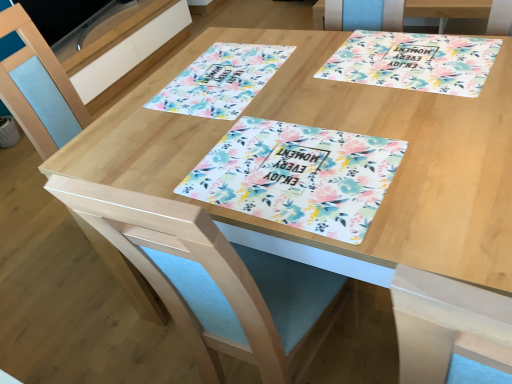
Question: Is blue fabric swivel chair at center not close to floral paper placemat at upper center, positioned as the first flyer in back-to-front order?

Choices:
 (A) yes
 (B) no

Answer: (B)

Question: Is blue fabric swivel chair at center facing towards floral paper placemat at upper center, positioned as the first flyer in back-to-front order?

Choices:
 (A) yes
 (B) no

Answer: (B)

Question: From a real-world perspective, does blue fabric swivel chair at center stand above floral paper placemat at upper center, acting as the second flyer starting from the front?

Choices:
 (A) no
 (B) yes

Answer: (A)

Question: Can you confirm if blue fabric swivel chair at center is taller than floral paper placemat at upper center, acting as the second flyer starting from the front?

Choices:
 (A) yes
 (B) no

Answer: (A)

Question: Can you confirm if blue fabric swivel chair at center is shorter than floral paper placemat at upper center, which is the 2th flyer in bottom-to-top order?

Choices:
 (A) yes
 (B) no

Answer: (B)

Question: Considering the relative positions of floral paper placemat at upper center, marked as the 1th flyer in a top-to-bottom arrangement, and light blue fabric chair at lower left in the image provided, is floral paper placemat at upper center, marked as the 1th flyer in a top-to-bottom arrangement, to the left or to the right of light blue fabric chair at lower left?

Choices:
 (A) right
 (B) left

Answer: (A)

Question: Is floral paper placemat at upper center, marked as the 1th flyer in a top-to-bottom arrangement, wider or thinner than light blue fabric chair at lower left?

Choices:
 (A) thin
 (B) wide

Answer: (A)

Question: Is floral paper placemat at upper center, which is the 2th flyer in bottom-to-top order, taller or shorter than light blue fabric chair at lower left?

Choices:
 (A) tall
 (B) short

Answer: (B)

Question: Considering their positions, is floral paper placemat at upper center, positioned as the first flyer in back-to-front order, located in front of or behind light blue fabric chair at lower left?

Choices:
 (A) behind
 (B) front

Answer: (B)

Question: From a real-world perspective, is white glossy drawer at upper left above or below floral paper placemat at center, the 2th flyer positioned from the top?

Choices:
 (A) above
 (B) below

Answer: (B)

Question: Is white glossy drawer at upper left in front of or behind floral paper placemat at center, the second flyer when ordered from back to front, in the image?

Choices:
 (A) behind
 (B) front

Answer: (A)

Question: Is white glossy drawer at upper left inside or outside of floral paper placemat at center, positioned as the 1th flyer in front-to-back order?

Choices:
 (A) inside
 (B) outside

Answer: (B)

Question: In terms of height, does white glossy drawer at upper left look taller or shorter compared to floral paper placemat at center, positioned as the 1th flyer in front-to-back order?

Choices:
 (A) tall
 (B) short

Answer: (A)

Question: Relative to white glossy drawer at upper left, is floral paper placemat at center, which is counted as the 1th flyer, starting from the bottom, in front or behind?

Choices:
 (A) front
 (B) behind

Answer: (A)

Question: From their relative heights in the image, would you say floral paper placemat at center, positioned as the 1th flyer in front-to-back order, is taller or shorter than white glossy drawer at upper left?

Choices:
 (A) tall
 (B) short

Answer: (B)